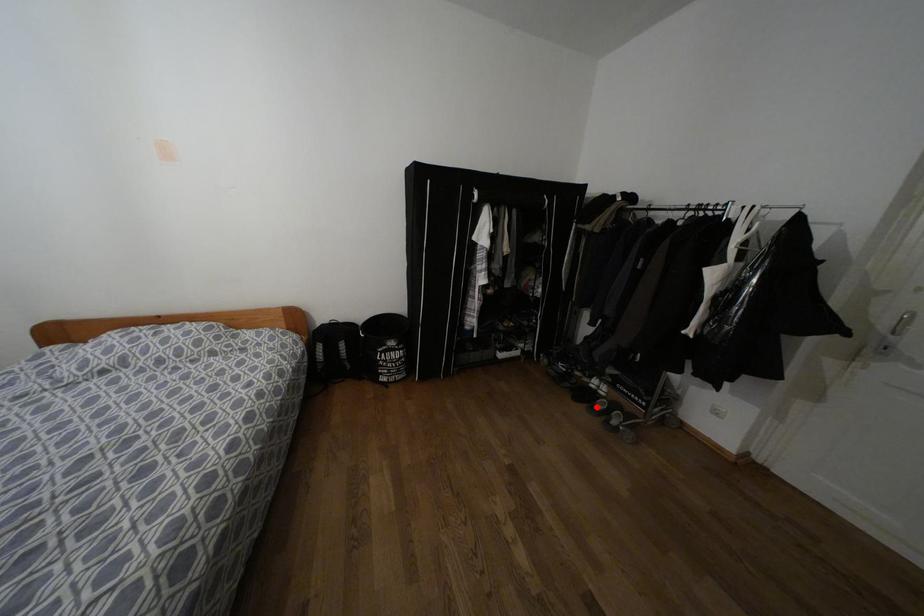
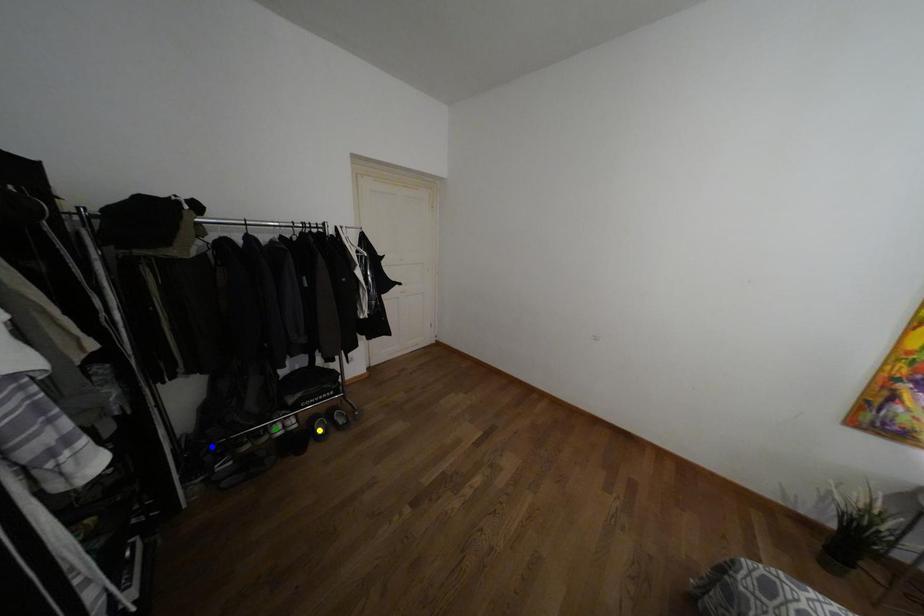
Question: I am providing you with two images of the same scene from different viewpoints. A red point is marked on the first image. You are given multiple points on the second image. Which mark in image 2 goes with the point in image 1?

Choices:
 (A) yellow point
 (B) blue point
 (C) green point

Answer: (A)